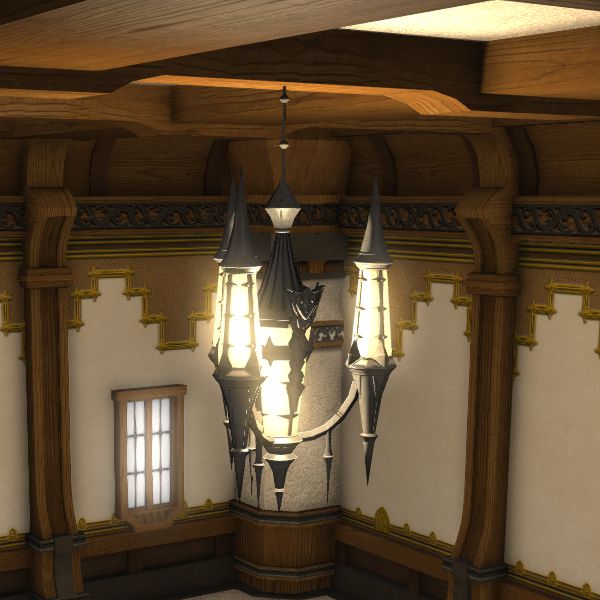
Locate an element on the screen. The image size is (600, 600). window frame is located at coordinates (152, 393), (179, 447), (123, 456), (143, 516).